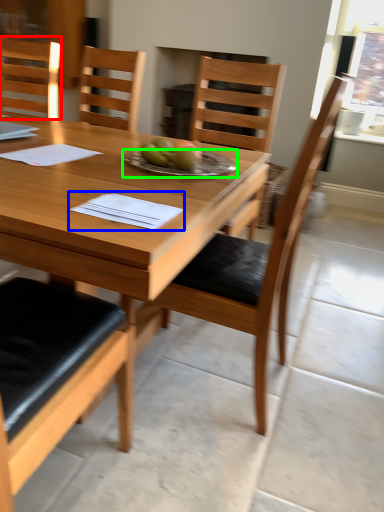
Question: Which is nearer to the chair (highlighted by a red box)? notebook (highlighted by a blue box) or plate (highlighted by a green box).

Choices:
 (A) notebook
 (B) plate

Answer: (B)